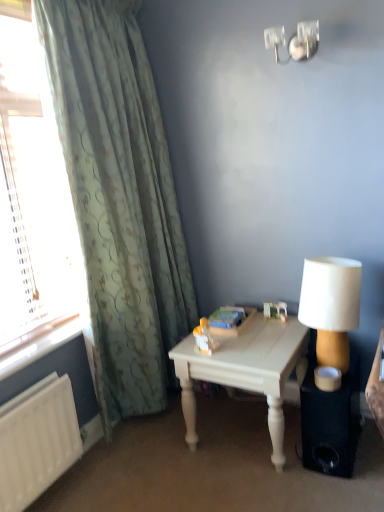
Where is `vacant space in front of black matte speaker at lower right`? The image size is (384, 512). vacant space in front of black matte speaker at lower right is located at coordinates (341, 488).